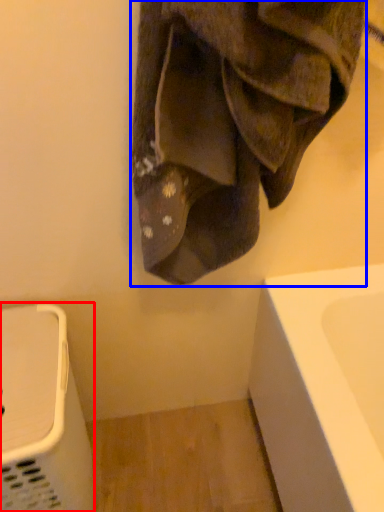
Question: Which of the following is the farthest to the observer, appliance (highlighted by a red box) or towel (highlighted by a blue box)?

Choices:
 (A) appliance
 (B) towel

Answer: (A)